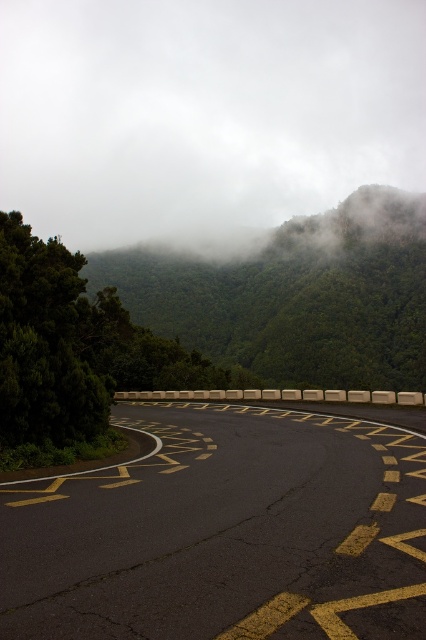
Question: Which point is closer to the camera taking this photo?

Choices:
 (A) (265, 368)
 (B) (396, 172)

Answer: (A)

Question: In this image, where is yellow asphalt road at center located relative to green leafy forest at upper center?

Choices:
 (A) below
 (B) above

Answer: (A)

Question: Among these points, which one is farthest from the camera?

Choices:
 (A) (164, 620)
 (B) (230, 336)
 (C) (290, 163)

Answer: (C)

Question: Does white foggy cloud at upper center appear on the left side of yellow asphalt road at center?

Choices:
 (A) no
 (B) yes

Answer: (A)

Question: Does white foggy cloud at upper center appear on the left side of green leafy forest at upper center?

Choices:
 (A) yes
 (B) no

Answer: (A)

Question: Which point is closer to the camera?

Choices:
 (A) (325, 250)
 (B) (314, 22)

Answer: (A)